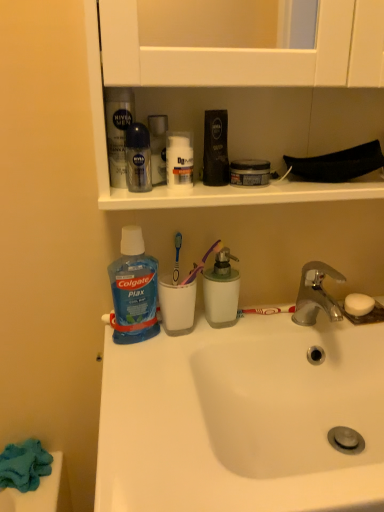
Find the location of a particular element. This screenshot has width=384, height=512. vacant area located to the right-hand side of blue plastic toothbrush at center, which is the 1th toothbrush from left to right is located at coordinates (248, 319).